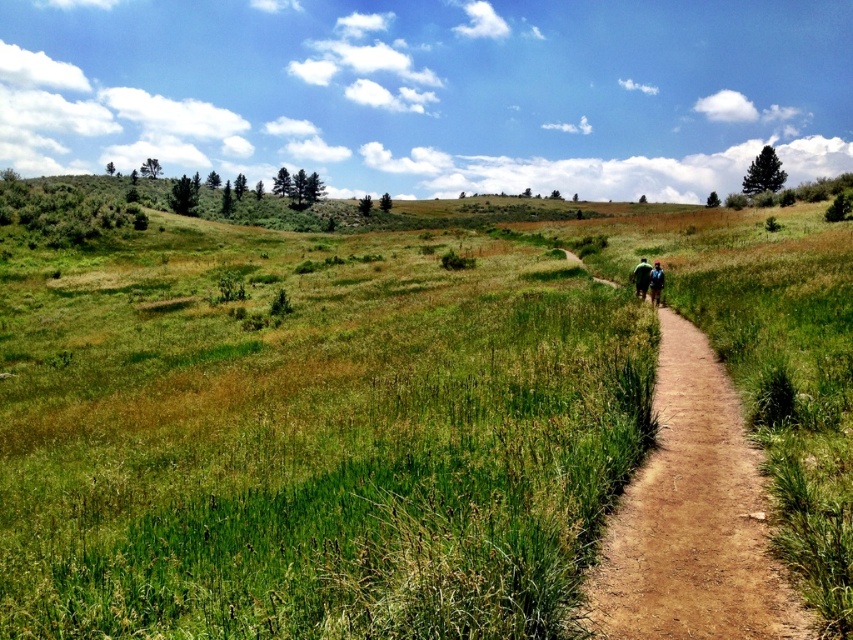
Is green fabric jacket at center closer to the viewer compared to green fabric jacket at center-right?

No.

Which of these two, green fabric jacket at center or green fabric jacket at center-right, stands shorter?

Standing shorter between the two is green fabric jacket at center-right.

You are a GUI agent. You are given a task and a screenshot of the screen. Output one action in this format:
    pyautogui.click(x=<x>, y=<y>)
    Task: Click on the green fabric jacket at center
    The image size is (853, 640).
    Given the screenshot: What is the action you would take?
    pyautogui.click(x=641, y=276)

Is brown dirt path at center behind green fabric jacket at center-right?

No, it is not.

Can you confirm if brown dirt path at center is positioned above green fabric jacket at center-right?

No.

Is point (728, 621) behind point (654, 282)?

No.

Locate an element on the screen. The width and height of the screenshot is (853, 640). brown dirt path at center is located at coordinates (692, 518).

Can you confirm if green grass at center is positioned above brown dirt path at center?

Correct, green grass at center is located above brown dirt path at center.

Is green grass at center bigger than brown dirt path at center?

Yes, green grass at center is bigger than brown dirt path at center.

Does point (665, 218) lie in front of point (775, 589)?

No, it is behind (775, 589).

Find the location of a particular element. The width and height of the screenshot is (853, 640). green grass at center is located at coordinates (387, 420).